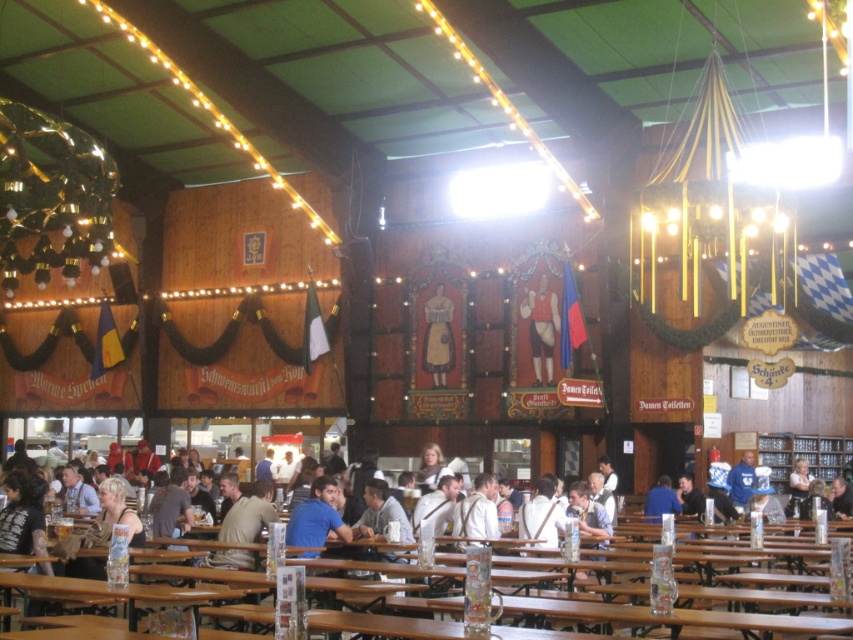
Question: Can you confirm if white fabric shirt at center is positioned below white leather jacket at lower right?

Choices:
 (A) no
 (B) yes

Answer: (B)

Question: Among these objects, which one is nearest to the camera?

Choices:
 (A) wooden figure at center
 (B) white fabric shirt at center
 (C) light brown wooden table at lower center

Answer: (C)

Question: Does blue matte shirt at center appear under white leather jacket at lower right?

Choices:
 (A) no
 (B) yes

Answer: (A)

Question: Which of these objects is positioned farthest from the blue matte shirt at center?

Choices:
 (A) wooden table at lower center
 (B) light brown leather jacket at center
 (C) blue fabric shirt at center

Answer: (B)

Question: Estimate the real-world distances between objects in this image. Which object is farther from the blue fabric shirt at center?

Choices:
 (A) wooden table at lower center
 (B) matte red leather jacket at center
 (C) blue fleece jacket at center
 (D) dark brown leather jacket at lower right

Answer: (A)

Question: Is blue fleece jacket at center below light brown leather jacket at center?

Choices:
 (A) no
 (B) yes

Answer: (B)